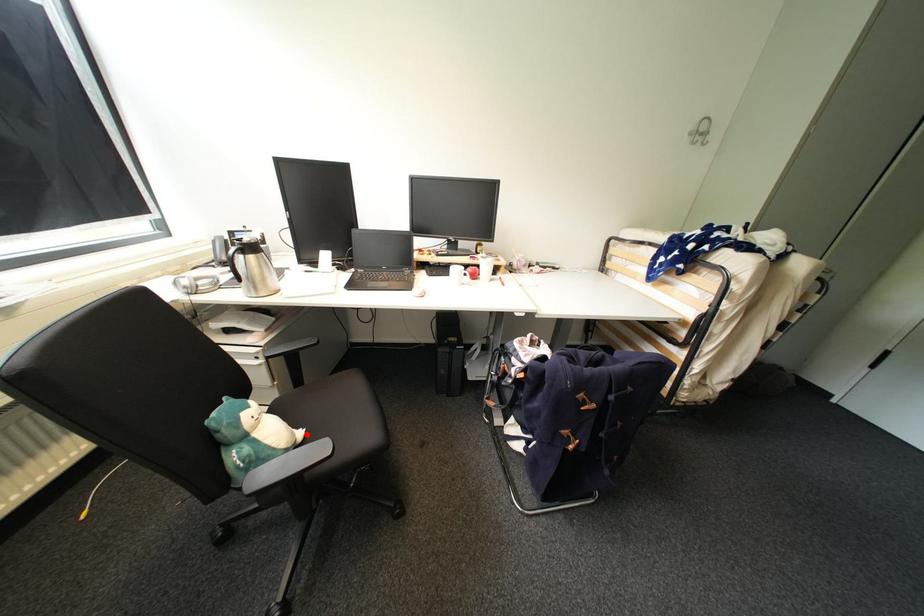
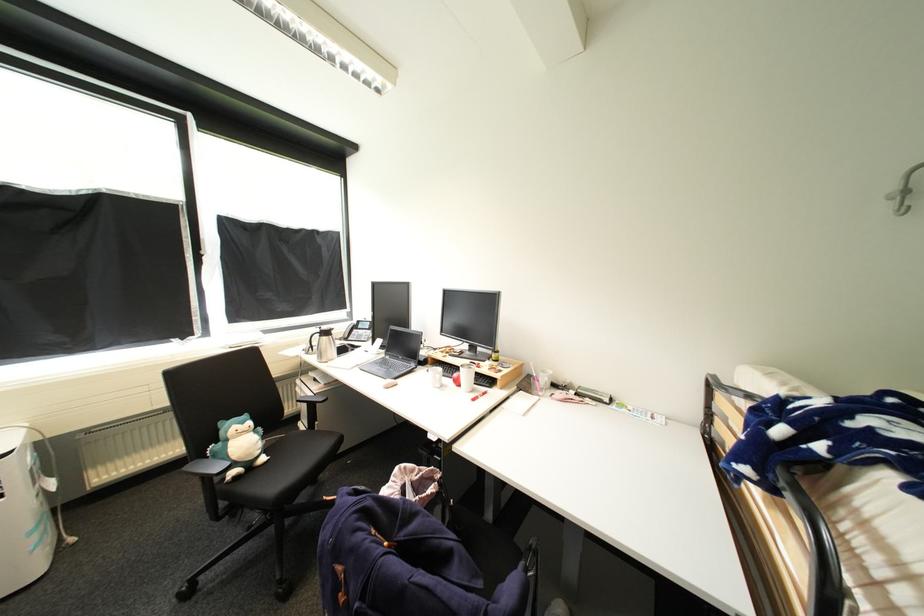
Locate, in the second image, the point that corresponds to the highlighted location in the first image.

(270, 460)